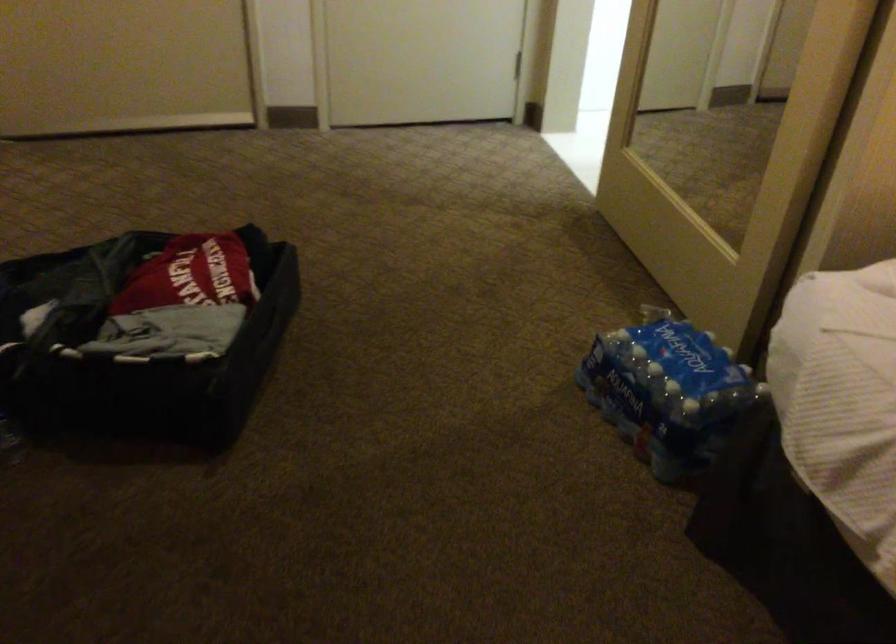
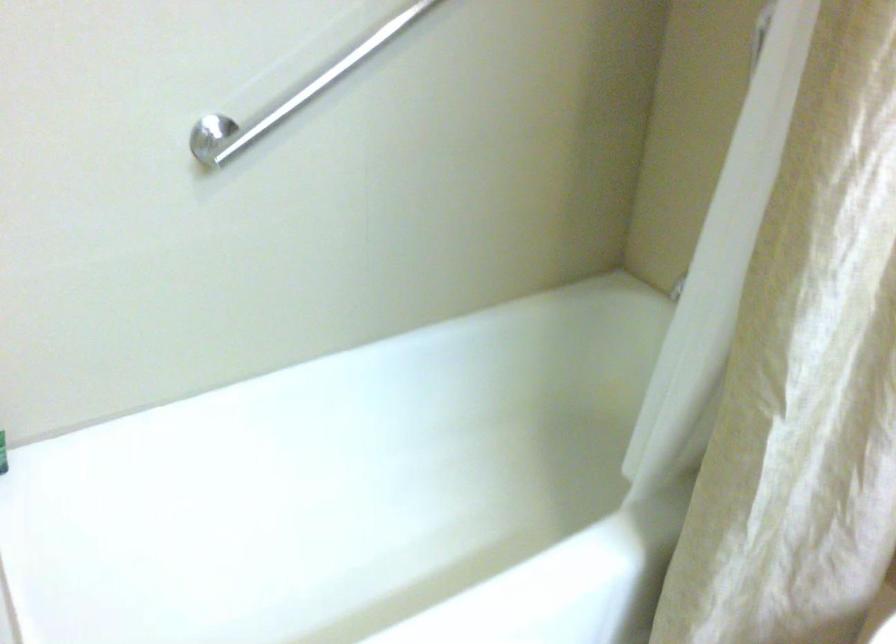
Question: The images are taken continuously from a first-person perspective. In which direction are you moving?

Choices:
 (A) Left
 (B) Right
 (C) Forward
 (D) Backward

Answer: (C)